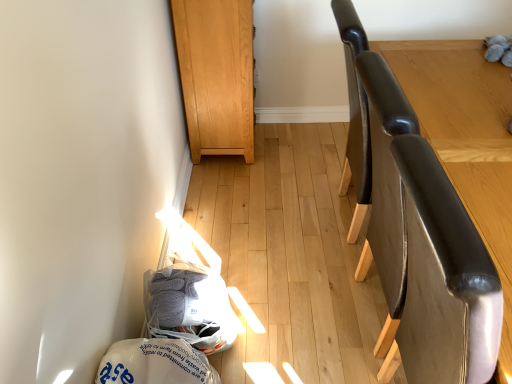
Question: Considering the positions of point (423, 147) and point (423, 233), is point (423, 147) closer or farther from the camera than point (423, 233)?

Choices:
 (A) closer
 (B) farther

Answer: (B)

Question: Is glossy leather chair at right taller or shorter than leather-like brown swivel chair at right?

Choices:
 (A) short
 (B) tall

Answer: (A)

Question: Which object is the farthest from the leather-like brown swivel chair at right?

Choices:
 (A) light brown wood cabinet at upper center
 (B) white plastic bag at lower left, marked as the second material in a top-to-bottom arrangement
 (C) gray yarn at lower left, which is the 1th material from top to bottom
 (D) glossy leather chair at right

Answer: (A)

Question: Based on their relative distances, which object is farther from the white plastic bag at lower left, marked as the second material in a top-to-bottom arrangement?

Choices:
 (A) gray yarn at lower left, which is counted as the 2th material, starting from the bottom
 (B) light brown wood cabinet at upper center
 (C) glossy leather chair at right
 (D) leather-like brown swivel chair at right

Answer: (B)